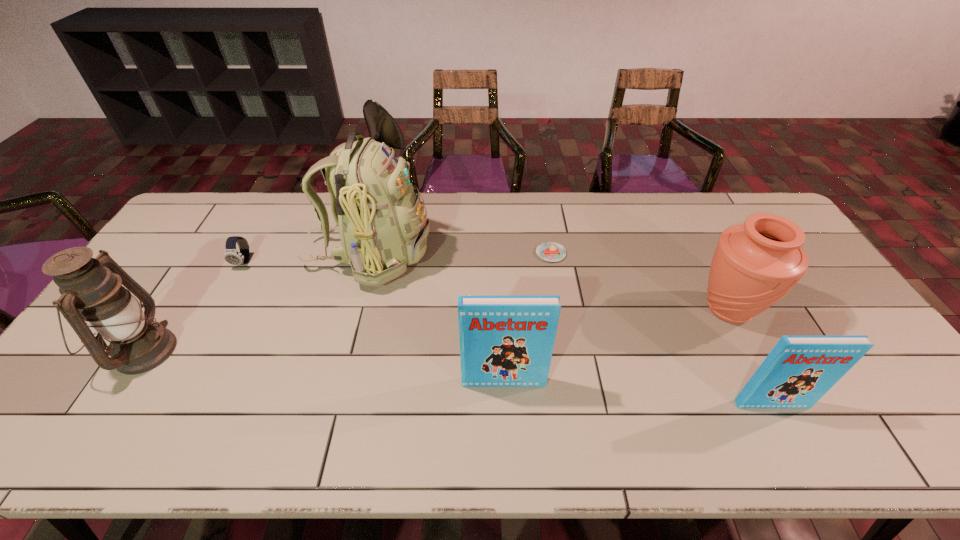
Locate an element on the screen. This screenshot has height=540, width=960. watch is located at coordinates (231, 255).

The image size is (960, 540). I want to click on the leftmost object, so click(x=91, y=293).

The height and width of the screenshot is (540, 960). What are the coordinates of `blank area located 0.390m on the front-facing side of the tallest object` in the screenshot? It's located at coord(554,254).

Locate an element on the screen. This screenshot has width=960, height=540. free location located on the front of the shortest object is located at coordinates (555, 279).

The width and height of the screenshot is (960, 540). In order to click on free spot located on the back of the vase in this screenshot , I will do `click(680, 214)`.

Locate an element on the screen. The width and height of the screenshot is (960, 540). free spot located on the face of the watch is located at coordinates (206, 330).

Where is `vacant space situated on the right of the oil lamp`? vacant space situated on the right of the oil lamp is located at coordinates (266, 351).

The height and width of the screenshot is (540, 960). I want to click on object present at the far edge, so click(x=381, y=220).

The width and height of the screenshot is (960, 540). In order to click on oil lamp present at the near edge in this screenshot , I will do (x=91, y=293).

I want to click on object that is at the left edge, so click(91, 293).